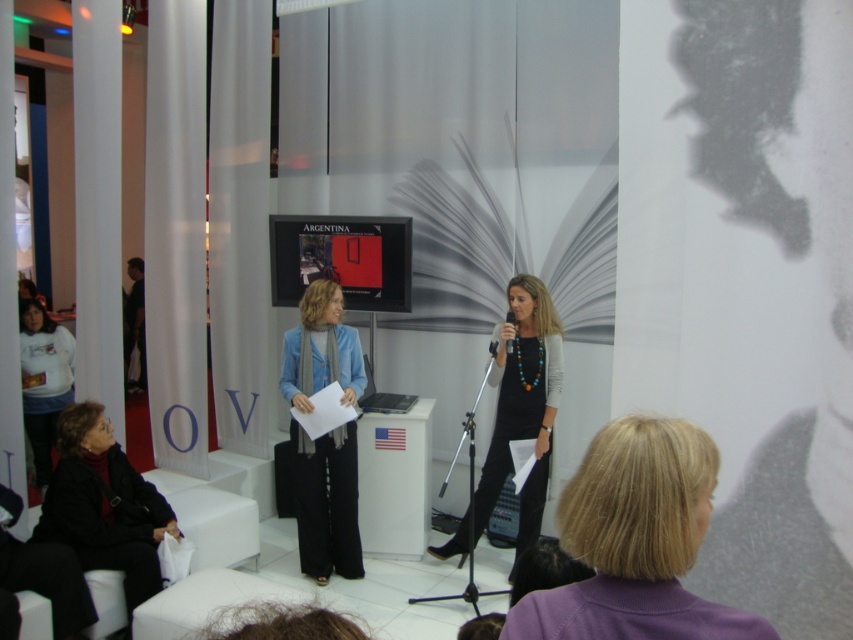
You are an event organizer who needs to ensure that the black glossy dress at center and the black plastic microphone at center are both visible to the audience. Based on their sizes, which object is more likely to block the view of the other?

The black glossy dress at center is bigger than the black plastic microphone at center, so the dress is more likely to block the view of the microphone if positioned in front of it.

You are an event coordinator planning to place a decorative plant between the black glossy dress at center and the black plastic microphone at center. Based on their positions, which side of the microphone should the plant be placed to align with the existing setup?

The black glossy dress at center is positioned on the left side of the black plastic microphone at center, so placing the decorative plant to the left of the microphone would align with the existing setup.

You are sitting in the audience at this event and want to know how far the point at coordinates (639, 442) is from where you are sitting. Can you determine the distance?

The point at coordinates (639, 442) is 3.54 feet from the viewer, so the distance is approximately 3.54 feet.